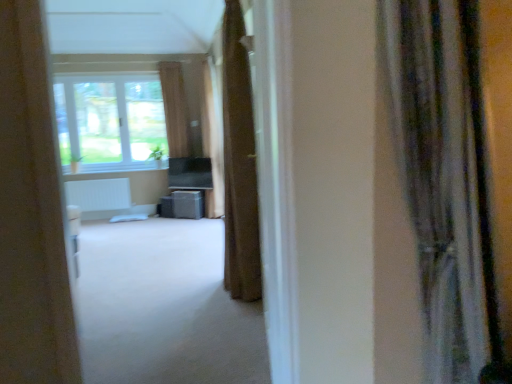
Locate an element on the screen. Image resolution: width=512 pixels, height=384 pixels. vacant space situated above white carpet at center (from a real-world perspective) is located at coordinates (161, 294).